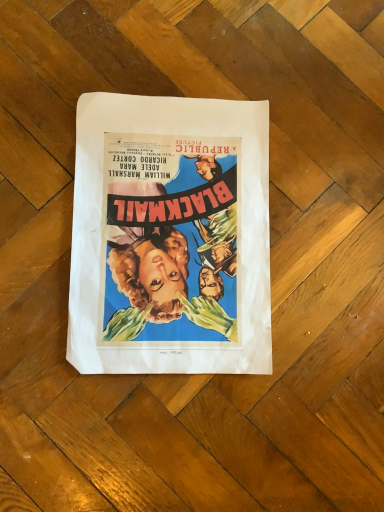
Where is `matte paper poster at center`? The width and height of the screenshot is (384, 512). matte paper poster at center is located at coordinates (170, 236).

What do you see at coordinates (170, 236) in the screenshot? I see `matte paper poster at center` at bounding box center [170, 236].

Measure the distance between point [181,368] and camera.

The depth of point [181,368] is 16.93 inches.

Find the location of a particular element. matte paper poster at center is located at coordinates (170, 236).